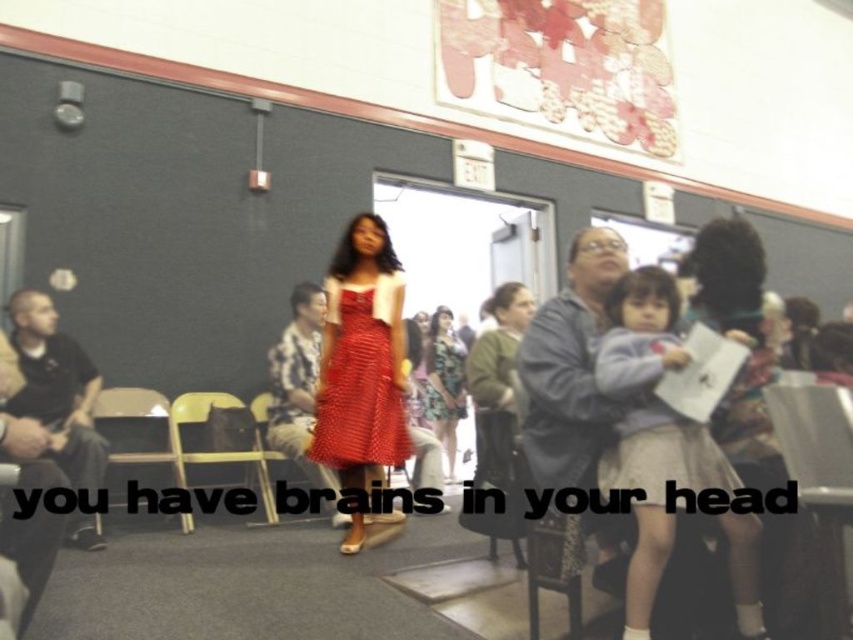
Question: Is polka dot dress at center positioned at the back of yellow plastic chair at center?

Choices:
 (A) yes
 (B) no

Answer: (A)

Question: Which object is closer to the camera taking this photo?

Choices:
 (A) polka dot fabric dress at center
 (B) polka dot dress at center
 (C) light blue fabric skirt at lower right

Answer: (C)

Question: Is polka dot fabric dress at center to the left of polka dot dress at center from the viewer's perspective?

Choices:
 (A) no
 (B) yes

Answer: (B)

Question: Among these objects, which one is nearest to the camera?

Choices:
 (A) polka dot dress at center
 (B) yellow plastic chair at center
 (C) light blue fabric skirt at lower right

Answer: (C)

Question: Which object is closer to the camera taking this photo?

Choices:
 (A) polka dot fabric dress at center
 (B) metallic silver chair at lower right

Answer: (B)

Question: Is light blue fabric skirt at lower right wider than polka dot dress at center?

Choices:
 (A) no
 (B) yes

Answer: (B)